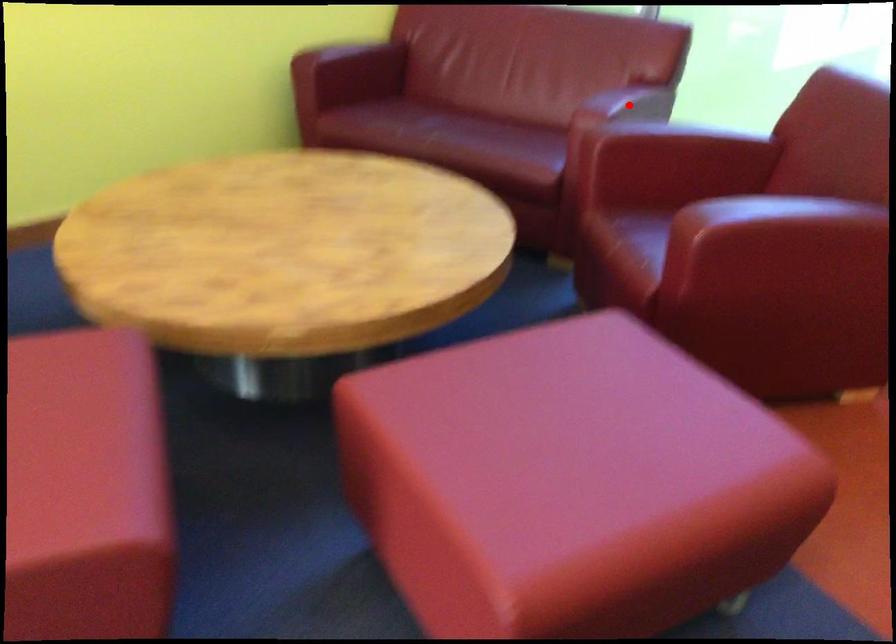
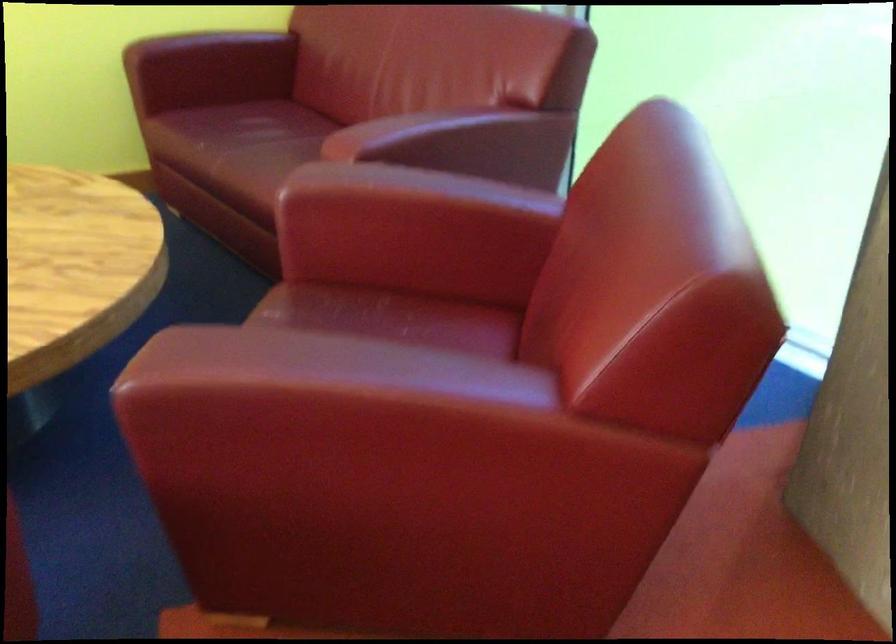
In the second image, find the point that corresponds to the highlighted location in the first image.

(438, 137)